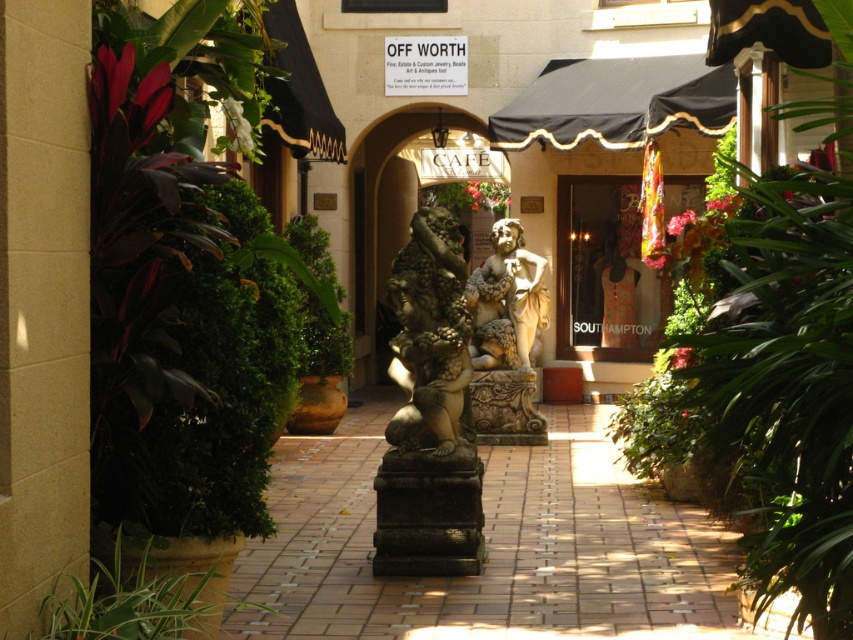
Describe the element at coordinates (386, 220) in the screenshot. I see `stone statue at center` at that location.

Does stone statue at center have a greater height compared to green leafy bush at center?

Incorrect, stone statue at center's height is not larger of green leafy bush at center's.

Measure the distance between stone statue at center and camera.

20.65 meters

The width and height of the screenshot is (853, 640). I want to click on stone statue at center, so click(x=386, y=220).

Is green leafy plant at lower left below stone statue at center?

Indeed, green leafy plant at lower left is positioned under stone statue at center.

Can you confirm if green leafy plant at lower left is smaller than stone statue at center?

No, green leafy plant at lower left is not smaller than stone statue at center.

Is point (115, 604) positioned after point (387, 244)?

No.

Image resolution: width=853 pixels, height=640 pixels. I want to click on green leafy plant at lower left, so click(x=148, y=593).

Is brown stone statue at center smaller than stone statue at center?

No, brown stone statue at center is not smaller than stone statue at center.

Describe the element at coordinates (431, 337) in the screenshot. I see `brown stone statue at center` at that location.

Which is behind, point (410, 221) or point (370, 186)?

Point (370, 186)

Find the location of a particular element. The height and width of the screenshot is (640, 853). brown stone statue at center is located at coordinates coord(431,337).